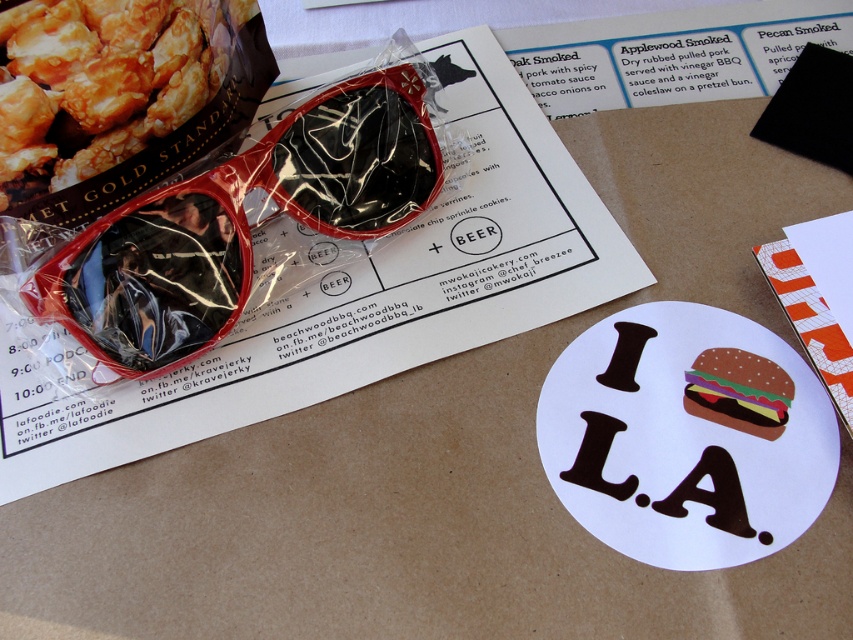
Which is more to the left, shiny red plastic sunglasses at upper left or golden crispy popcorn at upper left?

golden crispy popcorn at upper left is more to the left.

The image size is (853, 640). Describe the element at coordinates (241, 224) in the screenshot. I see `shiny red plastic sunglasses at upper left` at that location.

At what (x,y) coordinates should I click in order to perform the action: click on shiny red plastic sunglasses at upper left. Please return your answer as a coordinate pair (x, y). Image resolution: width=853 pixels, height=640 pixels. Looking at the image, I should click on (241, 224).

Which is in front, point (309, 220) or point (761, 369)?

Point (761, 369)

Which is more to the right, shiny red plastic sunglasses at upper left or polka-dotted paper burger at center?

polka-dotted paper burger at center

At what (x,y) coordinates should I click in order to perform the action: click on shiny red plastic sunglasses at upper left. Please return your answer as a coordinate pair (x, y). The height and width of the screenshot is (640, 853). Looking at the image, I should click on (241, 224).

Who is shorter, golden crispy popcorn at upper left or polka-dotted paper burger at center?

With less height is polka-dotted paper burger at center.

Is golden crispy popcorn at upper left taller than polka-dotted paper burger at center?

Indeed, golden crispy popcorn at upper left has a greater height compared to polka-dotted paper burger at center.

Identify the location of golden crispy popcorn at upper left. (103, 81).